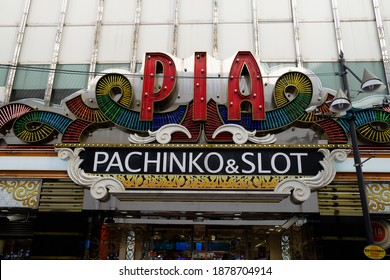
Locate an element on the screen. dark windows is located at coordinates (48, 244), (353, 238).